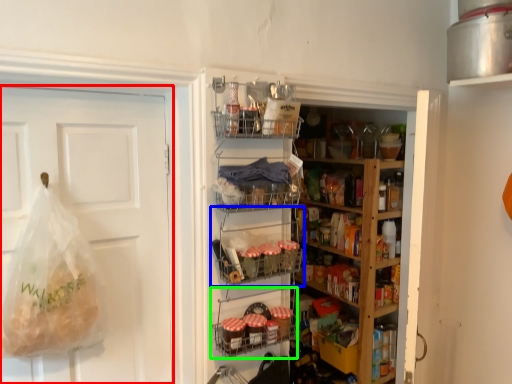
Question: Estimate the real-world distances between objects in this image. Which object is farther from door (highlighted by a red box), shelf (highlighted by a blue box) or shelf (highlighted by a green box)?

Choices:
 (A) shelf
 (B) shelf

Answer: (B)